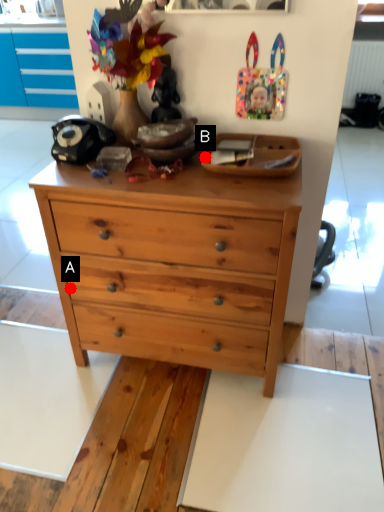
Question: Two points are circled on the image, labeled by A and B beside each circle. Which point is further to the camera?

Choices:
 (A) A is further
 (B) B is further

Answer: (A)